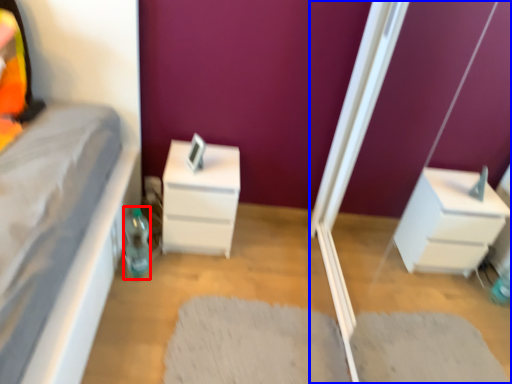
Question: Which point is further to the camera, bottle (highlighted by a red box) or screen door (highlighted by a blue box)?

Choices:
 (A) bottle
 (B) screen door

Answer: (A)